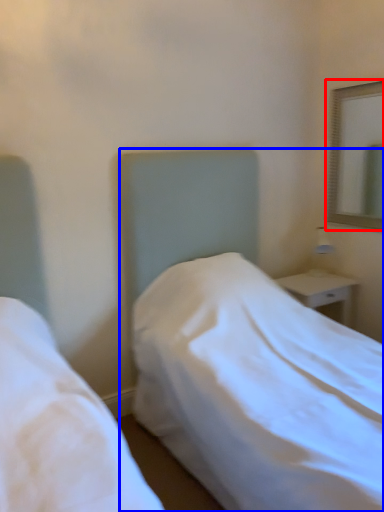
Question: Which point is closer to the camera, mirror (highlighted by a red box) or bed (highlighted by a blue box)?

Choices:
 (A) mirror
 (B) bed

Answer: (B)